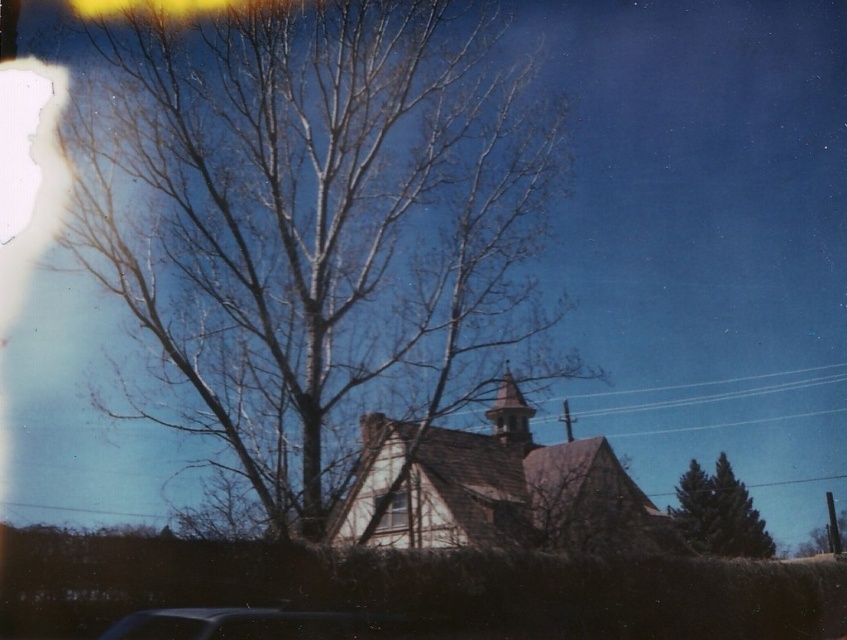
Consider the image. Between bare wood tree at center and wooden church at center, which one has less height?

With less height is wooden church at center.

Between point (424, 244) and point (501, 467), which one is positioned in front?

Positioned in front is point (424, 244).

Between point (403, 202) and point (382, 474), which one is positioned behind?

The point (403, 202) is more distant.

Image resolution: width=847 pixels, height=640 pixels. I want to click on bare wood tree at center, so click(x=313, y=228).

Is point (690, 484) more distant than point (502, 381)?

Yes, it is.

Based on the photo, between green needle-like tree at lower right and wooden spire at center, which one is positioned lower?

Positioned lower is green needle-like tree at lower right.

Which is in front, point (684, 480) or point (521, 397)?

Point (521, 397) is more forward.

The width and height of the screenshot is (847, 640). Find the location of `green needle-like tree at lower right`. green needle-like tree at lower right is located at coordinates (718, 513).

Is bare wood tree at center above wooden spire at center?

Yes, bare wood tree at center is above wooden spire at center.

Looking at this image, is bare wood tree at center taller than wooden spire at center?

Yes, bare wood tree at center is taller than wooden spire at center.

Find the location of a particular element. The width and height of the screenshot is (847, 640). bare wood tree at center is located at coordinates (313, 228).